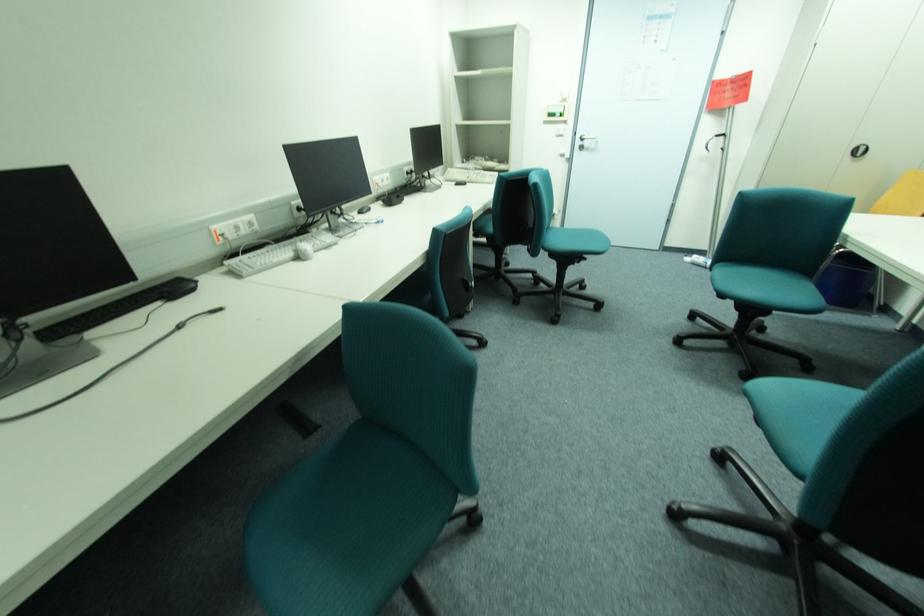
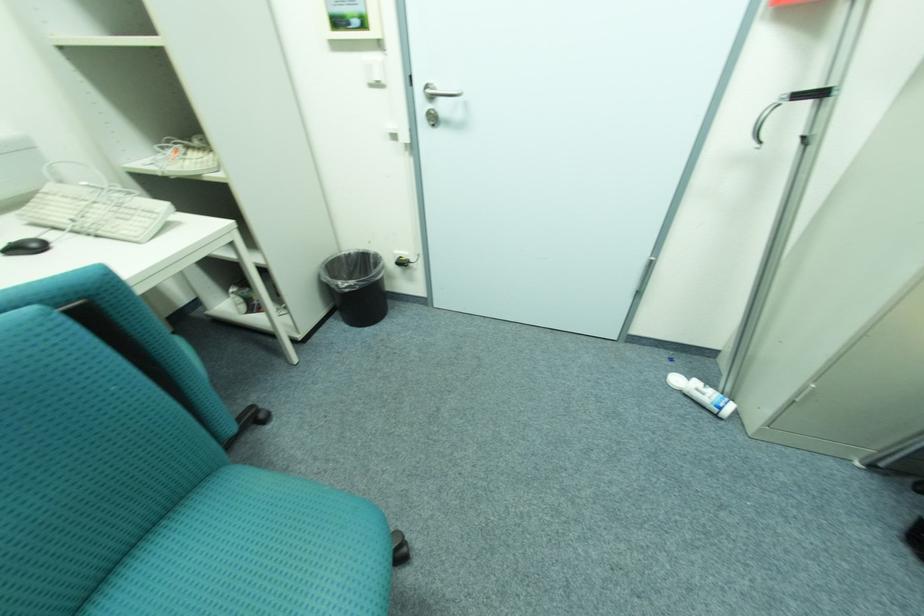
In the second image, find the point that corresponds to (x=589, y=140) in the first image.

(439, 97)